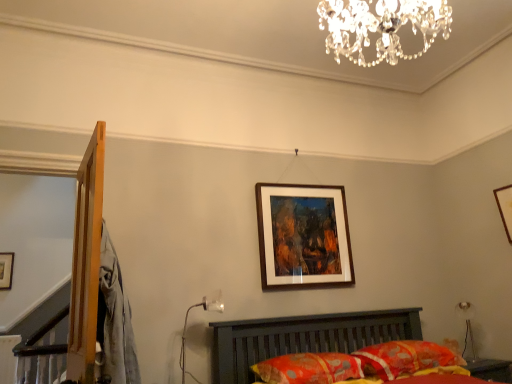
Question: Is wooden picture frame at upper center, the 1th picture frame positioned from the left, a part of floral fabric pillow at lower center, the 2th pillow in the right-to-left sequence?

Choices:
 (A) yes
 (B) no

Answer: (B)

Question: Is floral fabric pillow at lower center, which is the 1th pillow from left to right, wider than wooden picture frame at upper center, the 3th picture frame in the front-to-back sequence?

Choices:
 (A) yes
 (B) no

Answer: (A)

Question: Is floral fabric pillow at lower center, which is the 1th pillow from left to right, bigger than wooden picture frame at upper center, the 3th picture frame in the front-to-back sequence?

Choices:
 (A) yes
 (B) no

Answer: (A)

Question: From a real-world perspective, is floral fabric pillow at lower center, which is the 1th pillow from left to right, positioned over wooden picture frame at upper center, the 1th picture frame positioned from the left, based on gravity?

Choices:
 (A) no
 (B) yes

Answer: (A)

Question: Can you confirm if floral fabric pillow at lower center, the 2th pillow in the right-to-left sequence, is thinner than wooden picture frame at upper center, the 3th picture frame in the front-to-back sequence?

Choices:
 (A) no
 (B) yes

Answer: (A)

Question: Is floral fabric pillow at lower center, the 2th pillow in the right-to-left sequence, in front of wooden picture frame at upper center, the 1th picture frame positioned from the left?

Choices:
 (A) no
 (B) yes

Answer: (B)

Question: Would you say wooden picture frame at upper right, which is the second picture frame from front to back, is a long distance from wooden-framed painting at center, placed as the third picture frame when sorted from back to front?

Choices:
 (A) yes
 (B) no

Answer: (A)

Question: Does wooden picture frame at upper right, acting as the third picture frame starting from the left, appear on the right side of wooden-framed painting at center, which ranks as the second picture frame in right-to-left order?

Choices:
 (A) no
 (B) yes

Answer: (B)

Question: Does wooden picture frame at upper right, acting as the 1th picture frame starting from the right, touch wooden-framed painting at center, positioned as the 1th picture frame in front-to-back order?

Choices:
 (A) no
 (B) yes

Answer: (A)

Question: Would you say wooden-framed painting at center, which ranks as the second picture frame in right-to-left order, is part of wooden picture frame at upper right, acting as the third picture frame starting from the left,'s contents?

Choices:
 (A) yes
 (B) no

Answer: (B)

Question: Considering the relative positions of wooden picture frame at upper right, which is the second picture frame from front to back, and wooden-framed painting at center, acting as the 2th picture frame starting from the left, in the image provided, is wooden picture frame at upper right, which is the second picture frame from front to back, to the left of wooden-framed painting at center, acting as the 2th picture frame starting from the left, from the viewer's perspective?

Choices:
 (A) no
 (B) yes

Answer: (A)

Question: Can you confirm if wooden picture frame at upper right, which is the second picture frame from front to back, is thinner than wooden-framed painting at center, acting as the 2th picture frame starting from the left?

Choices:
 (A) yes
 (B) no

Answer: (B)

Question: Considering the relative sizes of wooden-framed painting at center, positioned as the 1th picture frame in front-to-back order, and metallic glass table lamp at lower center, which is the second table lamp from right to left, in the image provided, is wooden-framed painting at center, positioned as the 1th picture frame in front-to-back order, bigger than metallic glass table lamp at lower center, which is the second table lamp from right to left,?

Choices:
 (A) no
 (B) yes

Answer: (B)